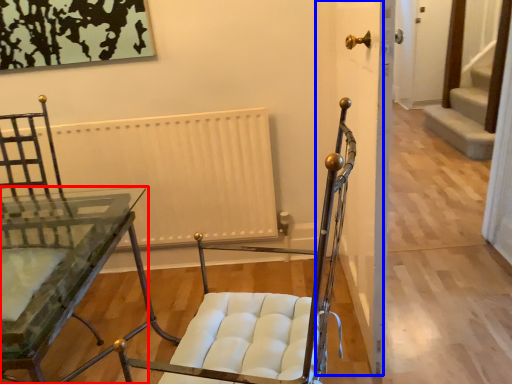
Question: Among these objects, which one is farthest to the camera, table (highlighted by a red box) or door (highlighted by a blue box)?

Choices:
 (A) table
 (B) door

Answer: (B)